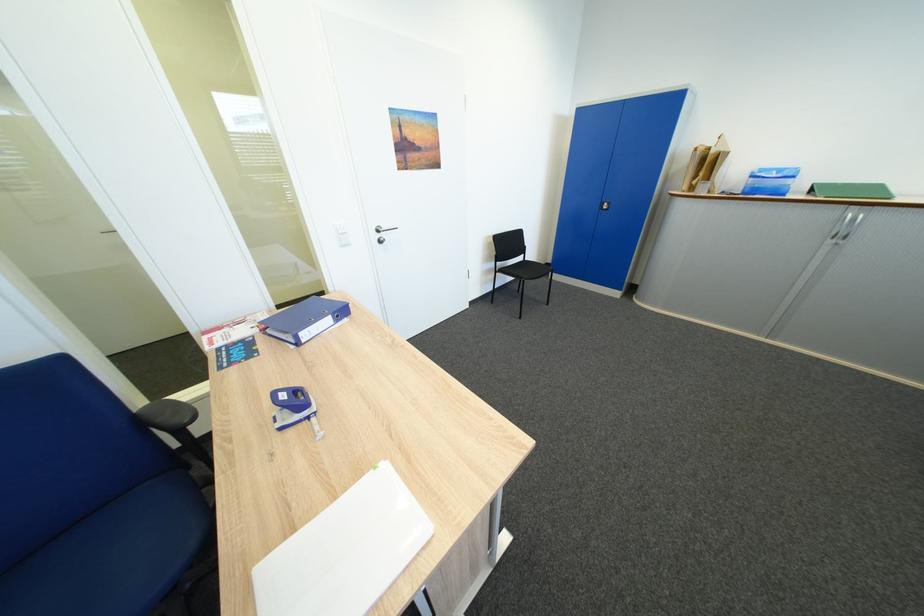
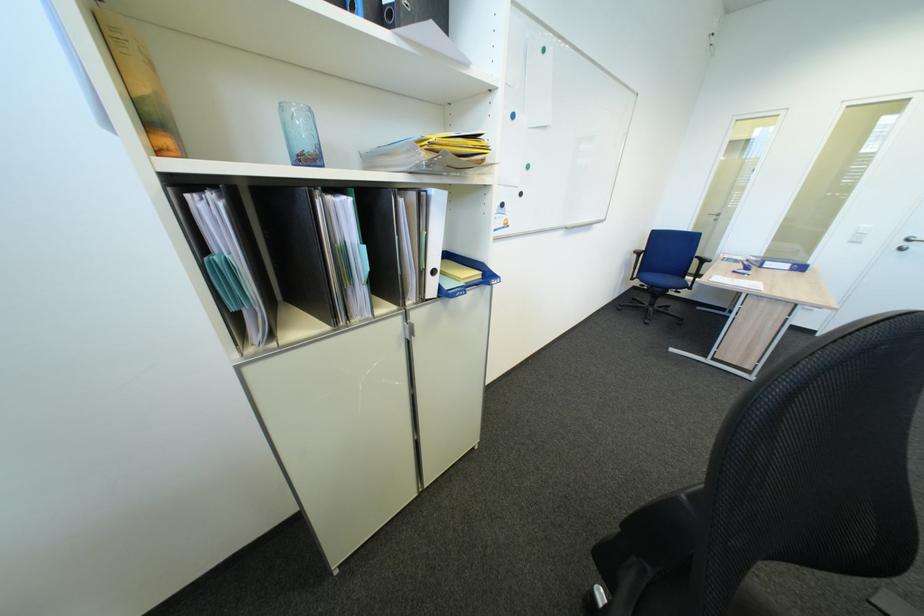
In the second image, find the point that corresponds to (x=293, y=430) in the first image.

(745, 274)